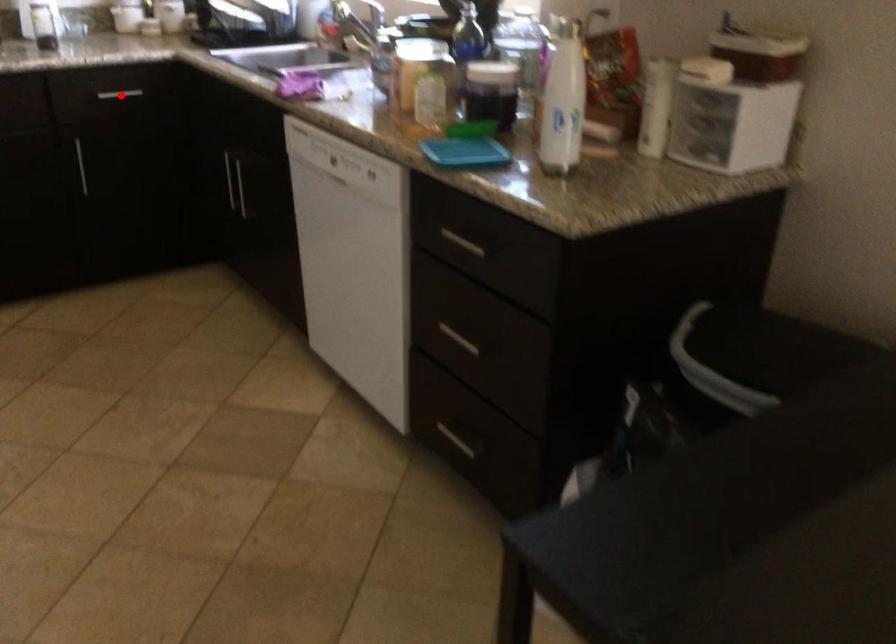
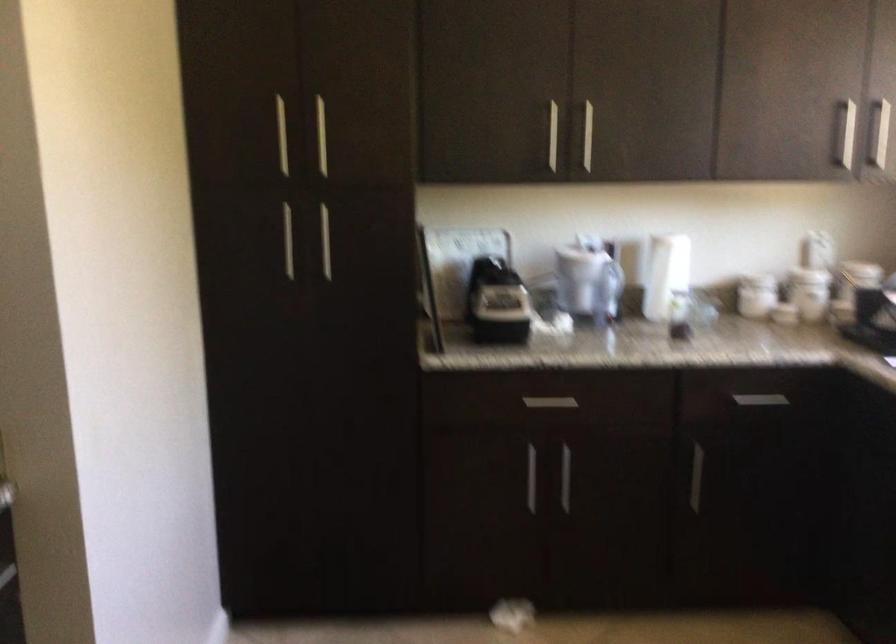
Question: I am providing you with two images of the same scene from different viewpoints. A red point is shown in image1. For the corresponding object point in image2, is it positioned nearer or farther from the camera?

Choices:
 (A) Nearer
 (B) Farther

Answer: (A)